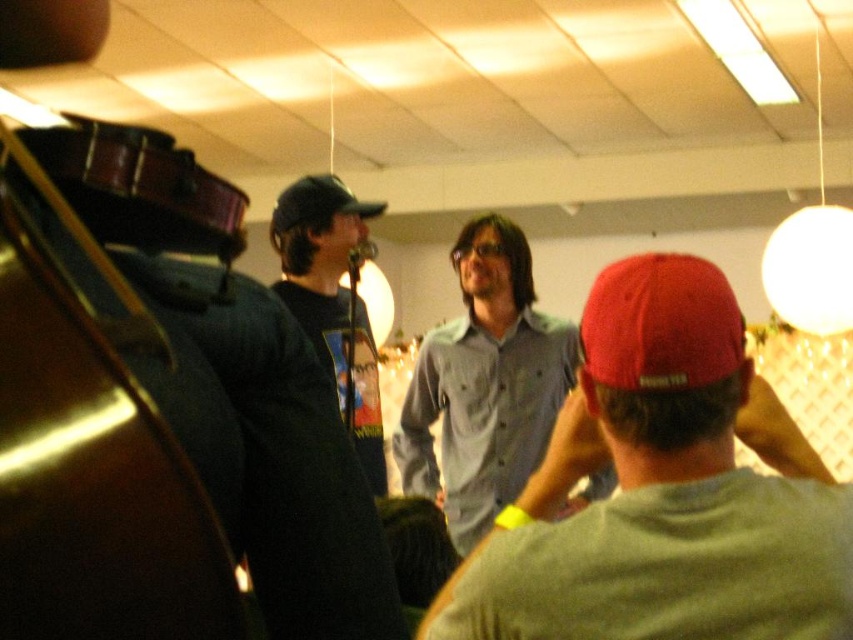
You are at an event and want to see the person with the red matte baseball cap at center. Is the denim shirt at center blocking your view of them?

The red matte baseball cap at center is behind the denim shirt at center, so the denim shirt at center is blocking the view of the person wearing the red matte baseball cap at center.